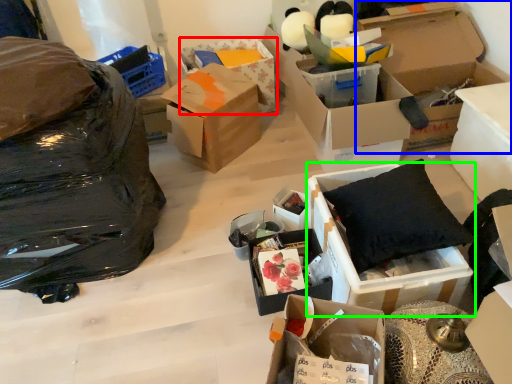
Question: Which object is positioned closest to box (highlighted by a red box)? Select from box (highlighted by a blue box) and box (highlighted by a green box).

Choices:
 (A) box
 (B) box

Answer: (A)